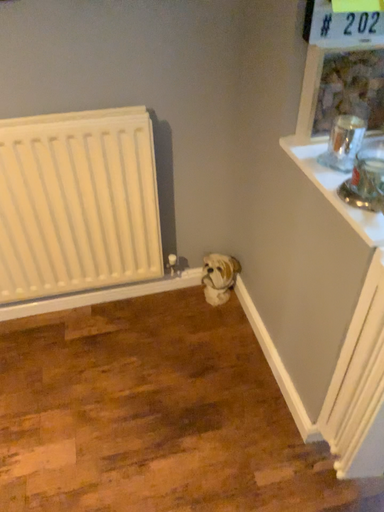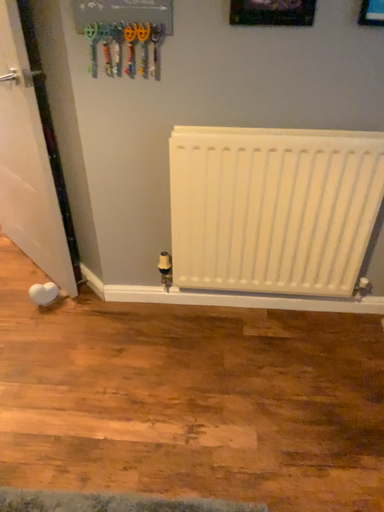
Question: Which way did the camera rotate in the video?

Choices:
 (A) rotated left
 (B) rotated right

Answer: (A)